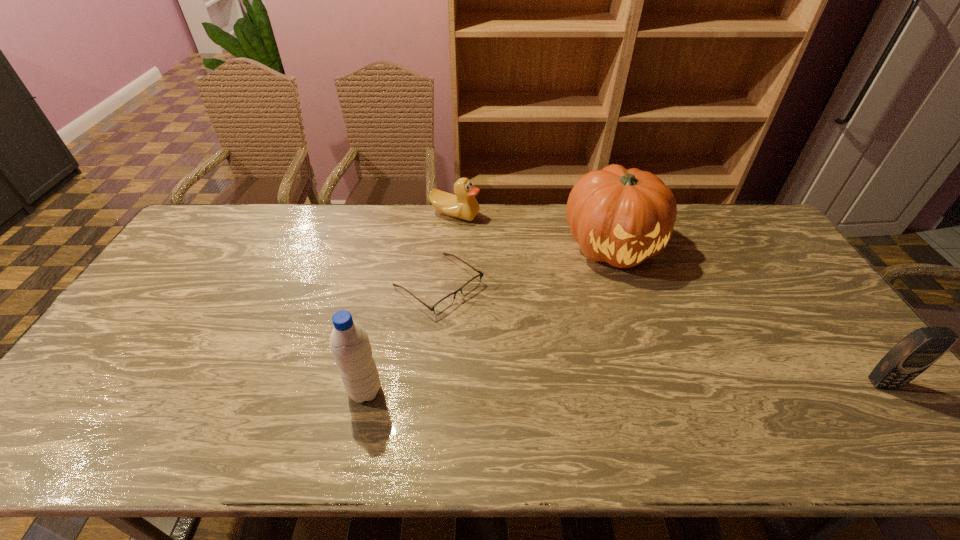
You are a GUI agent. You are given a task and a screenshot of the screen. Output one action in this format:
    pyautogui.click(x=<x>, y=<y>)
    Task: Click on the water bottle
    
    Given the screenshot: What is the action you would take?
    pyautogui.click(x=349, y=342)

Locate an element on the screen. the third tallest object is located at coordinates (915, 353).

I want to click on cellular telephone, so click(x=915, y=353).

The width and height of the screenshot is (960, 540). In order to click on the shortest object in this screenshot , I will do `click(447, 301)`.

Find the location of `the fourth object from left to right`. the fourth object from left to right is located at coordinates (622, 217).

Image resolution: width=960 pixels, height=540 pixels. What are the coordinates of `duck` in the screenshot? It's located at (463, 205).

I want to click on vacant space located on the left of the water bottle, so click(258, 390).

The height and width of the screenshot is (540, 960). What are the coordinates of `vacant area situated 0.200m on the front-facing side of the shortest object` in the screenshot? It's located at (521, 349).

Where is `vacant space located on the front-facing side of the shortest object`? The image size is (960, 540). vacant space located on the front-facing side of the shortest object is located at coordinates 576,391.

The width and height of the screenshot is (960, 540). I want to click on free location located on the front-facing side of the shortest object, so click(x=513, y=342).